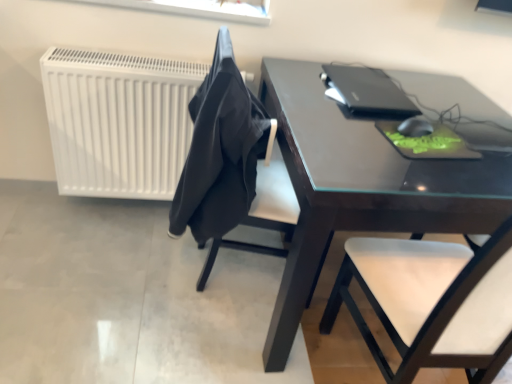
I want to click on free space to the left of black fabric chair at center, so click(147, 264).